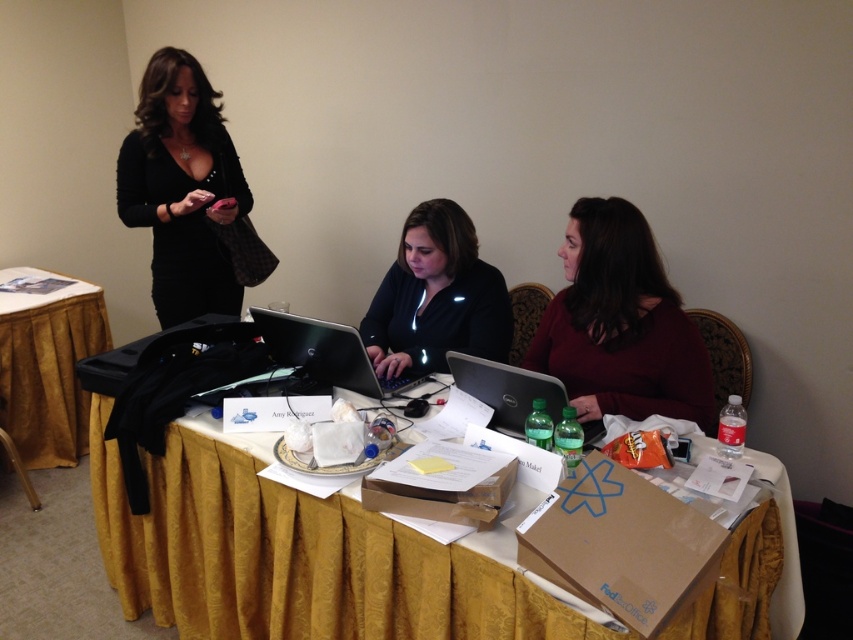
Who is positioned more to the right, black matte dress at upper left or gold fabric table at lower left?

black matte dress at upper left is more to the right.

Does point (194, 214) come behind point (106, 324)?

No, it is not.

Between point (190, 314) and point (0, 308), which one is positioned behind?

Positioned behind is point (0, 308).

Locate an element on the screen. The height and width of the screenshot is (640, 853). black matte dress at upper left is located at coordinates (183, 188).

Does yellow fabric tablecloth at center come in front of gold fabric table at lower left?

Yes.

Which is more to the right, yellow fabric tablecloth at center or gold fabric table at lower left?

Positioned to the right is yellow fabric tablecloth at center.

Does point (186, 584) lie behind point (35, 378)?

That is False.

Where is `yellow fabric tablecloth at center`? yellow fabric tablecloth at center is located at coordinates (300, 556).

Is point (786, 477) behind point (549, 323)?

No, it is not.

Is yellow fabric tablecloth at center taller than burgundy sweater at center?

Indeed, yellow fabric tablecloth at center has a greater height compared to burgundy sweater at center.

What do you see at coordinates (300, 556) in the screenshot? The height and width of the screenshot is (640, 853). I see `yellow fabric tablecloth at center` at bounding box center [300, 556].

The image size is (853, 640). In order to click on yellow fabric tablecloth at center in this screenshot , I will do `click(300, 556)`.